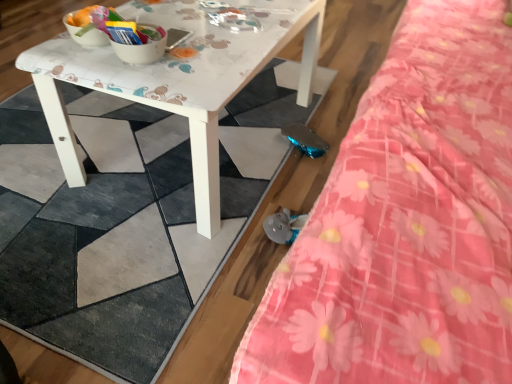
What do you see at coordinates (179, 80) in the screenshot?
I see `white glossy table at upper center` at bounding box center [179, 80].

This screenshot has width=512, height=384. I want to click on white glossy table at upper center, so click(179, 80).

The width and height of the screenshot is (512, 384). Identify the location of white glossy table at upper center. (179, 80).